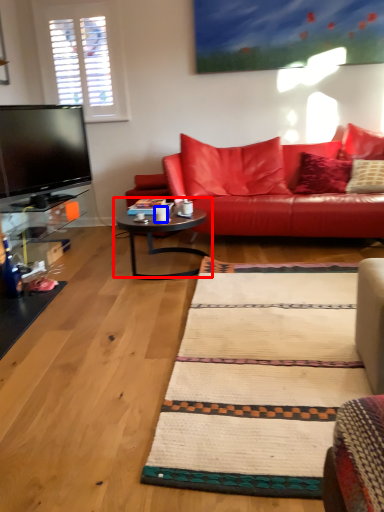
Question: Which object appears closest to the camera in this image, coffee table (highlighted by a red box) or coffee cup (highlighted by a blue box)?

Choices:
 (A) coffee table
 (B) coffee cup

Answer: (A)